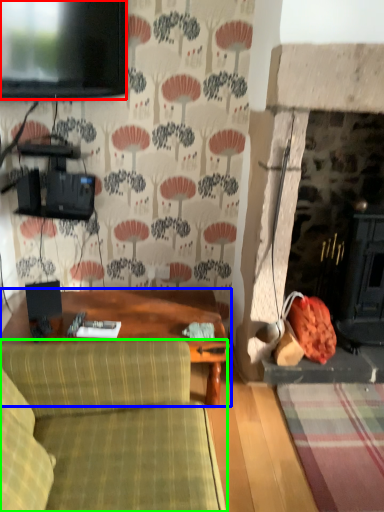
Question: Estimate the real-world distances between objects in this image. Which object is farther from television (highlighted by a red box), table (highlighted by a blue box) or studio couch (highlighted by a green box)?

Choices:
 (A) table
 (B) studio couch

Answer: (B)